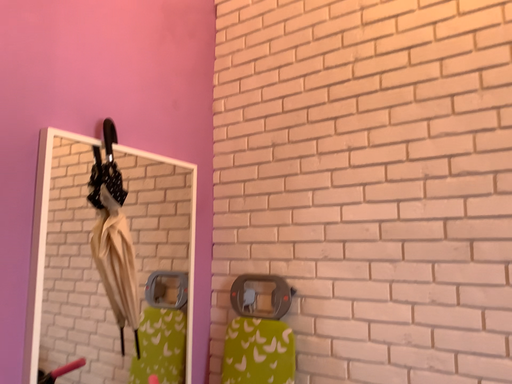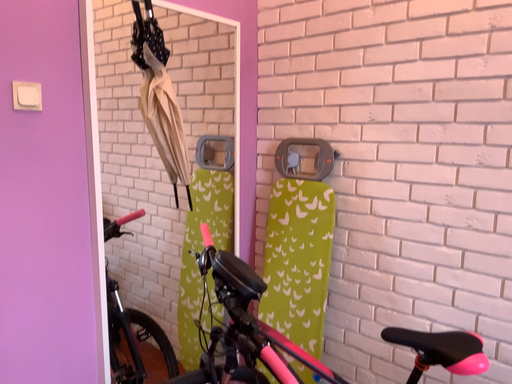
Question: Which way did the camera rotate in the video?

Choices:
 (A) rotated right
 (B) rotated left

Answer: (B)